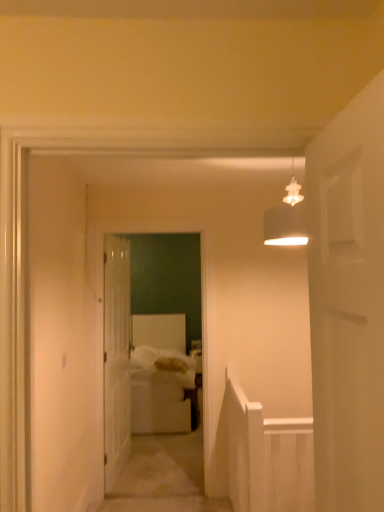
Describe the element at coordinates (287, 218) in the screenshot. The width and height of the screenshot is (384, 512). I see `matte white lampshade at upper center` at that location.

I want to click on matte white lampshade at upper center, so click(x=287, y=218).

The width and height of the screenshot is (384, 512). What do you see at coordinates (160, 376) in the screenshot? I see `white soft bed at center` at bounding box center [160, 376].

What is the approximate width of white fabric bed at center?

white fabric bed at center is 8.50 centimeters in width.

The width and height of the screenshot is (384, 512). What do you see at coordinates (131, 361) in the screenshot?
I see `white fabric bed at center` at bounding box center [131, 361].

Where is `white soft bedsheet at center`? The height and width of the screenshot is (512, 384). white soft bedsheet at center is located at coordinates (158, 369).

At what (x,y) coordinates should I click in order to perform the action: click on matte white lampshade at upper center. Please return your answer as a coordinate pair (x, y). The image size is (384, 512). Looking at the image, I should click on (287, 218).

Considering the relative sizes of white soft bed at center and matte white lampshade at upper center in the image provided, is white soft bed at center smaller than matte white lampshade at upper center?

No, white soft bed at center is not smaller than matte white lampshade at upper center.

Is white soft bed at center aimed at matte white lampshade at upper center?

No, white soft bed at center is not facing towards matte white lampshade at upper center.

Does point (138, 471) appear closer or farther from the camera than point (297, 229)?

Point (138, 471) is farther from the camera than point (297, 229).

Between white soft bed at center and matte white lampshade at upper center, which one appears on the left side from the viewer's perspective?

From the viewer's perspective, white soft bed at center appears more on the left side.

From the picture: Can you confirm if white soft bed at center is shorter than white soft bedsheet at center?

Correct, white soft bed at center is not as tall as white soft bedsheet at center.

From a real-world perspective, is white soft bed at center positioned over white soft bedsheet at center based on gravity?

No, from a real-world perspective, white soft bed at center is not on top of white soft bedsheet at center.

What are the coordinates of `light fixture that is on the right side of white soft bed at center` in the screenshot? It's located at (287, 218).

From a real-world perspective, is white soft bed at center above or below matte white lampshade at upper center?

white soft bed at center is situated lower than matte white lampshade at upper center in the real world.

Choose the correct answer: Is white soft bed at center inside matte white lampshade at upper center or outside it?

white soft bed at center cannot be found inside matte white lampshade at upper center.

Between point (143, 396) and point (297, 231), which one is positioned behind?

The point (143, 396) is behind.

Which of these two, white soft bedsheet at center or white fabric bed at center, is smaller?

With smaller size is white fabric bed at center.

Visually, is white soft bedsheet at center positioned to the left or to the right of white fabric bed at center?

In the image, white soft bedsheet at center appears on the left side of white fabric bed at center.

Are white soft bedsheet at center and white fabric bed at center located far from each other?

Actually, white soft bedsheet at center and white fabric bed at center are a little close together.

What's the angular difference between white soft bedsheet at center and white fabric bed at center's facing directions?

They differ by 0.105 degrees in their facing directions.

Locate an element on the screen. path located underneath the white fabric bed at center (from a real-world perspective) is located at coordinates (163, 477).

From a real-world perspective, is white fabric bed at center beneath white soft bed at center?

No.

From the image's perspective, which one is positioned lower, white fabric bed at center or white soft bed at center?

white soft bed at center, from the image's perspective.

Considering the positions of points (114, 302) and (129, 502), is point (114, 302) farther from camera compared to point (129, 502)?

Yes.

Is white glossy door at center oriented away from white soft bed at center?

No, white glossy door at center's orientation is not away from white soft bed at center.

Considering the points (127, 387) and (133, 481), which point is in front, point (127, 387) or point (133, 481)?

The point (133, 481) is closer to the camera.

Between white glossy door at center and white soft bed at center, which one has smaller size?

With smaller size is white glossy door at center.

You are a GUI agent. You are given a task and a screenshot of the screen. Output one action in this format:
    pyautogui.click(x=<x>, y=<y>)
    Task: Click on the light fixture above the white fabric bed at center (from a real-world perspective)
    This screenshot has height=512, width=384.
    Given the screenshot: What is the action you would take?
    pyautogui.click(x=287, y=218)

From the image's perspective, is matte white lampshade at upper center located above or below white fabric bed at center?

matte white lampshade at upper center is above white fabric bed at center.

Looking at their sizes, would you say matte white lampshade at upper center is wider or thinner than white fabric bed at center?

Clearly, matte white lampshade at upper center has more width compared to white fabric bed at center.

Does point (302, 210) lie behind point (129, 295)?

No, (302, 210) is in front of (129, 295).

In order to click on path below the matte white lampshade at upper center (from the image's perspective) in this screenshot , I will do `click(163, 477)`.

The image size is (384, 512). I want to click on sheet on the left of white soft bed at center, so click(158, 369).

Which object lies nearer to the anchor point white glossy door at center, white fabric bed at center or white soft bedsheet at center?

Based on the image, white fabric bed at center appears to be nearer to white glossy door at center.

When comparing their distances from white soft bed at center, does white glossy door at center or matte white lampshade at upper center seem closer?

white glossy door at center.

Looking at the image, which one is located closer to white glossy door at center, white soft bedsheet at center or matte white lampshade at upper center?

white soft bedsheet at center is positioned closer to the anchor white glossy door at center.

Consider the image. Estimate the real-world distances between objects in this image. Which object is closer to white soft bed at center, white glossy door at center or white soft bedsheet at center?

The object closer to white soft bed at center is white soft bedsheet at center.

Considering their positions, is white glossy door at center positioned further to white soft bedsheet at center than matte white lampshade at upper center?

Among the two, matte white lampshade at upper center is located further to white soft bedsheet at center.

Estimate the real-world distances between objects in this image. Which object is further from white fabric bed at center, matte white lampshade at upper center or white soft bed at center?

The object further to white fabric bed at center is matte white lampshade at upper center.

Which object lies further to the anchor point white soft bed at center, white fabric bed at center or matte white lampshade at upper center?

matte white lampshade at upper center is further to white soft bed at center.

Considering their positions, is white fabric bed at center positioned further to white soft bed at center than white glossy door at center?

white glossy door at center is further to white soft bed at center.

Where is `corridor positioned between matte white lampshade at upper center and white glossy door at center from near to far`? The image size is (384, 512). corridor positioned between matte white lampshade at upper center and white glossy door at center from near to far is located at coordinates (131, 361).

The width and height of the screenshot is (384, 512). In order to click on corridor between matte white lampshade at upper center and white soft bed at center in the vertical direction in this screenshot , I will do `click(131, 361)`.

You are a GUI agent. You are given a task and a screenshot of the screen. Output one action in this format:
    pyautogui.click(x=<x>, y=<y>)
    Task: Click on the corridor located between matte white lampshade at upper center and white soft bed at center in the depth direction
    This screenshot has width=384, height=512.
    Given the screenshot: What is the action you would take?
    pyautogui.click(x=131, y=361)

Identify the location of corridor between matte white lampshade at upper center and white soft bedsheet at center in the front-back direction. (131, 361).